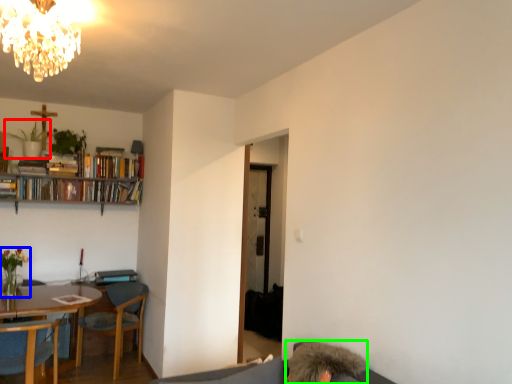
Question: Which object is positioned farthest from plant (highlighted by a red box)? Select from houseplant (highlighted by a blue box) and person (highlighted by a green box).

Choices:
 (A) houseplant
 (B) person

Answer: (B)